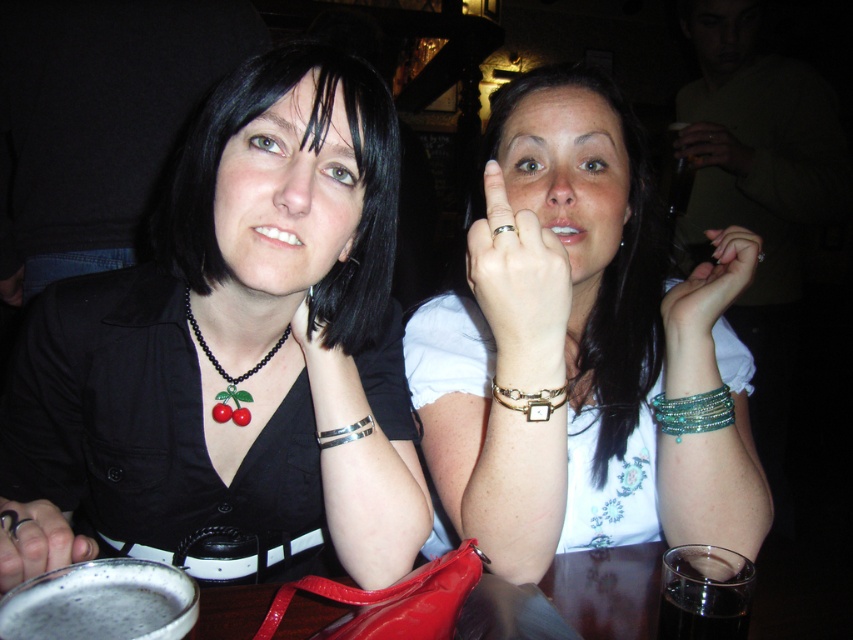
Does metallic ring at lower left appear on the left side of teal beaded bracelet at right?

Yes, metallic ring at lower left is to the left of teal beaded bracelet at right.

Which of these two, metallic ring at lower left or teal beaded bracelet at right, stands taller?

metallic ring at lower left

Between point (62, 541) and point (700, 400), which one is positioned behind?

Positioned behind is point (700, 400).

This screenshot has width=853, height=640. I want to click on metallic ring at lower left, so [38, 541].

Image resolution: width=853 pixels, height=640 pixels. What do you see at coordinates (518, 280) in the screenshot? I see `gold metallic ring at upper center` at bounding box center [518, 280].

Does gold metallic ring at upper center appear under dark glass at lower right?

Incorrect, gold metallic ring at upper center is not positioned below dark glass at lower right.

Between point (567, 257) and point (688, 545), which one is positioned in front?

Point (688, 545)

Identify the location of gold metallic ring at upper center. (518, 280).

Is foamy dark liquid at lower left wider than metallic ring at lower left?

No, foamy dark liquid at lower left is not wider than metallic ring at lower left.

Is foamy dark liquid at lower left behind metallic ring at lower left?

That is False.

At what (x,y) coordinates should I click in order to perform the action: click on foamy dark liquid at lower left. Please return your answer as a coordinate pair (x, y). The image size is (853, 640). Looking at the image, I should click on (102, 602).